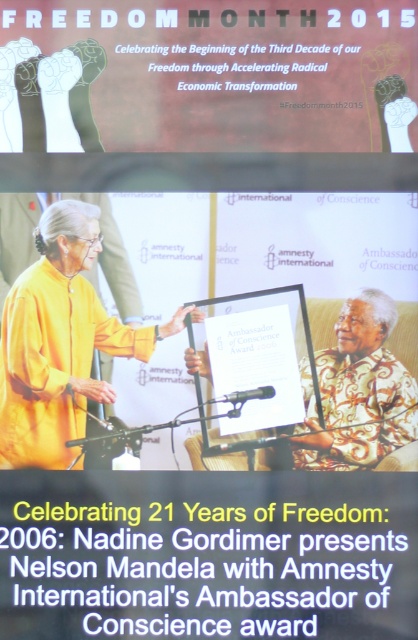
You are a photographer who needs to adjust the lighting for a photo shoot. You notice the white floral shirt at center and the black metallic microphone at center in the image. Which object is closer to the camera lens?

The white floral shirt at center is in front of the black metallic microphone at center, so it is closer to the camera lens.

You are an observer looking at the image. There are two points marked in the scene. The first point is at coordinates point (45, 392) and the second point is at point (239, 396). Which of these two points is closer to you?

Point (45, 392) is closer to you because it is further to the viewer than point (239, 396).

What is located at the coordinate point (361, 380) in the image?

The white floral shirt at center is located at the coordinate point (361, 380).